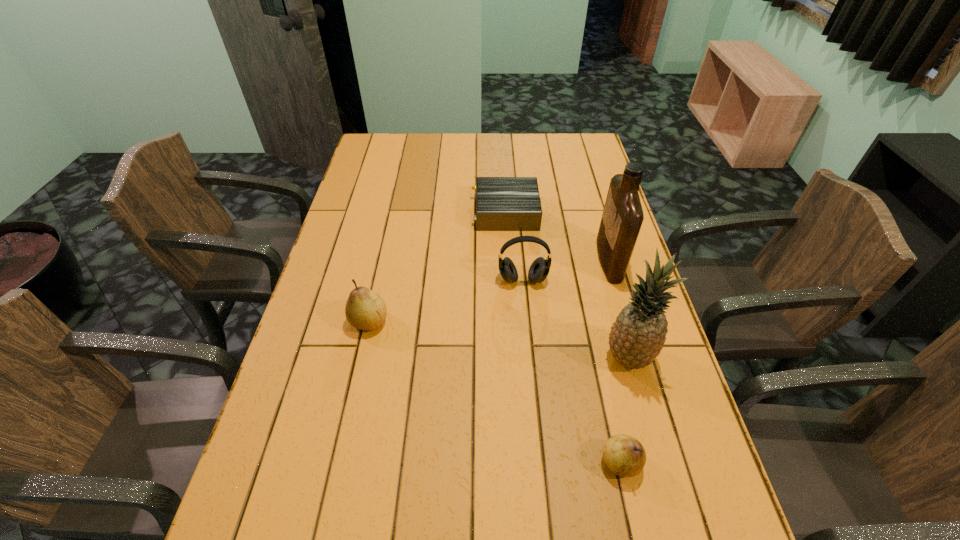
Locate an element on the screen. vacant region located on the back of the fifth tallest object is located at coordinates (586, 304).

At what (x,y) coordinates should I click in order to perform the action: click on blank space located 0.280m on the label side of the liquor. Please return your answer as a coordinate pair (x, y). The image size is (960, 540). Looking at the image, I should click on (506, 260).

Where is `free spot located on the label side of the liquor`? free spot located on the label side of the liquor is located at coordinates (506, 260).

The image size is (960, 540). I want to click on free space located on the label side of the liquor, so click(x=529, y=260).

At what (x,y) coordinates should I click in order to perform the action: click on vacant space located 0.160m on the back panel of the farthest object. Please return your answer as a coordinate pair (x, y). The image size is (960, 540). Looking at the image, I should click on (424, 212).

Image resolution: width=960 pixels, height=540 pixels. I want to click on free region located on the back panel of the farthest object, so click(421, 212).

At what (x,y) coordinates should I click in order to perform the action: click on free space located on the back panel of the farthest object. Please return your answer as a coordinate pair (x, y). Looking at the image, I should click on (421, 212).

This screenshot has width=960, height=540. In order to click on vacant point located on the front of the pineapple in this screenshot , I will do `click(660, 474)`.

Where is `free spot located 0.100m on the ear cups of the headset`? free spot located 0.100m on the ear cups of the headset is located at coordinates (526, 316).

The image size is (960, 540). In order to click on object that is at the near edge in this screenshot , I will do `click(625, 456)`.